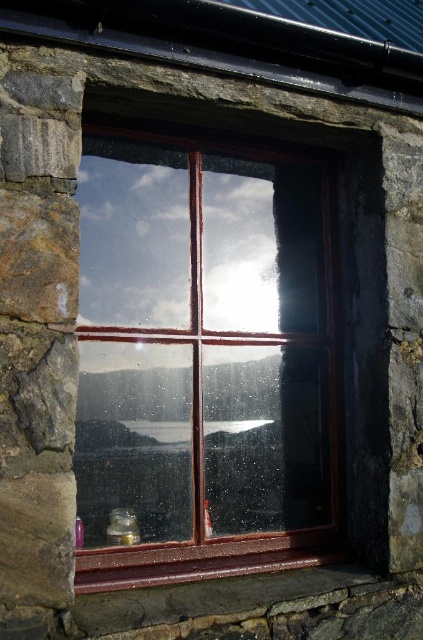
Question: Does wooden window at center come in front of brown wood at bottom?

Choices:
 (A) no
 (B) yes

Answer: (A)

Question: Can you confirm if wooden window at center is positioned below brown wood at bottom?

Choices:
 (A) yes
 (B) no

Answer: (B)

Question: Which of the following is the closest to the observer?

Choices:
 (A) (107, 545)
 (B) (131, 586)

Answer: (B)

Question: Where is wooden window at center located in relation to brown wood at bottom in the image?

Choices:
 (A) left
 (B) right

Answer: (A)